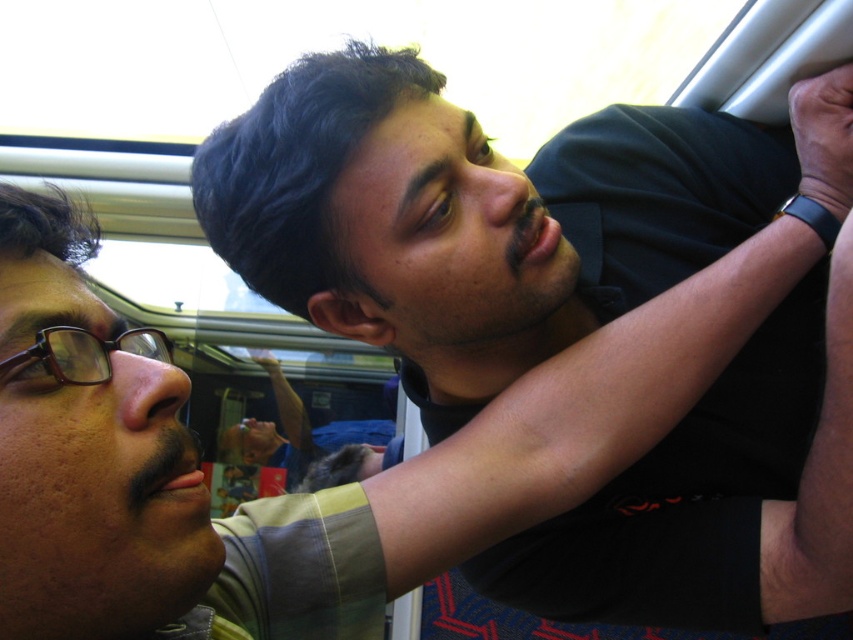
What are the coordinates of `black matte shirt at upper center` in the screenshot? It's located at (485, 212).

Between black matte shirt at upper center and brown plastic glasses at left, which one appears on the right side from the viewer's perspective?

From the viewer's perspective, black matte shirt at upper center appears more on the right side.

Locate an element on the screen. The height and width of the screenshot is (640, 853). black matte shirt at upper center is located at coordinates (485, 212).

You are a GUI agent. You are given a task and a screenshot of the screen. Output one action in this format:
    pyautogui.click(x=<x>, y=<y>)
    Task: Click on the black matte shirt at upper center
    
    Given the screenshot: What is the action you would take?
    pyautogui.click(x=485, y=212)